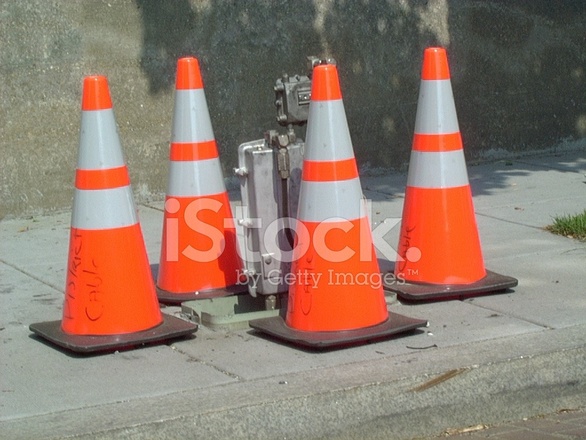
Identify the location of shadow on wall. The height and width of the screenshot is (440, 586). (373, 46).